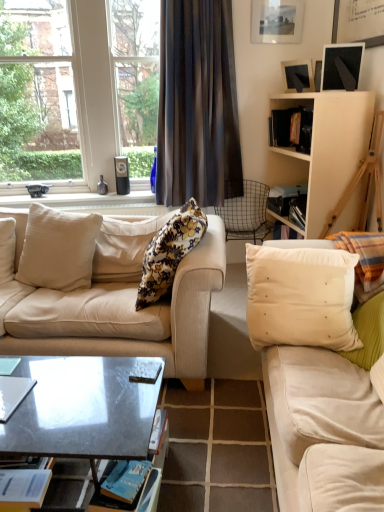
The image size is (384, 512). What do you see at coordinates (197, 105) in the screenshot?
I see `dark fabric curtain at center` at bounding box center [197, 105].

Measure the distance between point (15, 389) and camera.

They are 4.93 feet apart.

Locate an element on the screen. The image size is (384, 512). white cotton pillow at right, which is the third pillow from left to right is located at coordinates coord(301,297).

Image resolution: width=384 pixels, height=512 pixels. In order to click on clear glass window at upper left in this screenshot , I will do `click(75, 92)`.

Measure the distance between clear glass window at upper left and camera.

clear glass window at upper left is 3.03 meters from camera.

What is the approximate height of beige fabric couch at left, which is the first studio couch in left-to-right order?

beige fabric couch at left, which is the first studio couch in left-to-right order, is 80.57 centimeters tall.

Identify the location of floral fabric pillow at center, acting as the third pillow starting from the right. The width and height of the screenshot is (384, 512). (169, 252).

Is beige fabric couch at left, the 2th studio couch when ordered from right to left, inside white matte cabinet at upper right?

No, beige fabric couch at left, the 2th studio couch when ordered from right to left, is not surrounded by white matte cabinet at upper right.

Which is closer, (361,93) or (129,247)?

Positioned in front is point (129,247).

Which is in front, white matte cabinet at upper right or beige fabric couch at left, which is the first studio couch in left-to-right order?

Positioned in front is beige fabric couch at left, which is the first studio couch in left-to-right order.

Which object is thinner, white matte cabinet at upper right or beige fabric couch at left, the 2th studio couch when ordered from right to left?

white matte cabinet at upper right.

Locate an element on the screen. coffee table in front of the beige fabric pillow at left, which ranks as the fourth pillow in right-to-left order is located at coordinates (83, 410).

Is beige fabric pillow at left, which is counted as the 1th pillow, starting from the left, next to metallic gray coffee table at center?

No, beige fabric pillow at left, which is counted as the 1th pillow, starting from the left, is not making contact with metallic gray coffee table at center.

Could metallic gray coffee table at center be considered to be inside beige fabric pillow at left, which is counted as the 1th pillow, starting from the left?

No, metallic gray coffee table at center is not surrounded by beige fabric pillow at left, which is counted as the 1th pillow, starting from the left.

Is beige fabric pillow at left, which ranks as the fourth pillow in right-to-left order, wider or thinner than metallic gray coffee table at center?

beige fabric pillow at left, which ranks as the fourth pillow in right-to-left order, is thinner than metallic gray coffee table at center.

Locate an element on the screen. This screenshot has height=512, width=384. coffee table on the left of matte black picture frame at upper right is located at coordinates (83, 410).

Do you think metallic gray coffee table at center is within matte black picture frame at upper right, or outside of it?

metallic gray coffee table at center exists outside the volume of matte black picture frame at upper right.

From a real-world perspective, which is physically below, metallic gray coffee table at center or matte black picture frame at upper right?

From a 3D spatial view, metallic gray coffee table at center is below.

Which object is further away from the camera, matte black picture frame at upper right or metallic gray coffee table at center?

matte black picture frame at upper right is behind.

From the image's perspective, is matte black picture frame at upper right beneath metallic gray coffee table at center?

Actually, matte black picture frame at upper right appears above metallic gray coffee table at center in the image.

How different are the orientations of matte black picture frame at upper right and metallic gray coffee table at center in degrees?

The facing directions of matte black picture frame at upper right and metallic gray coffee table at center are 52.5 degrees apart.

Would you say clear glass window at upper left is inside or outside matte gray magazine at lower left, which is the 2th magazine in bottom-to-top order?

clear glass window at upper left lies outside matte gray magazine at lower left, which is the 2th magazine in bottom-to-top order.

Is point (12, 177) farther from viewer compared to point (17, 394)?

Yes, point (12, 177) is behind point (17, 394).

Locate an element on the screen. The height and width of the screenshot is (512, 384). the 1st magazine counting from the right of the clear glass window at upper left is located at coordinates (13, 394).

Would you say white fabric pillow at right, which is the 1th pillow from right to left, is to the left or to the right of dark fabric curtain at center in the picture?

Based on their positions, white fabric pillow at right, which is the 1th pillow from right to left, is located to the right of dark fabric curtain at center.

Which pillow is the 2nd one when counting from the right side of the dark fabric curtain at center? Please provide its 2D coordinates.

[(364, 260)]

Is the depth of white fabric pillow at right, marked as the fourth pillow in a left-to-right arrangement, greater than that of dark fabric curtain at center?

No, the depth of white fabric pillow at right, marked as the fourth pillow in a left-to-right arrangement, is less than that of dark fabric curtain at center.

From the image's perspective, is dark fabric curtain at center positioned above or below matte glass window sill at upper left?

dark fabric curtain at center is above matte glass window sill at upper left.

Is dark fabric curtain at center placed right next to matte glass window sill at upper left?

No, dark fabric curtain at center is not touching matte glass window sill at upper left.

Is dark fabric curtain at center aimed at matte glass window sill at upper left?

No.

You are a GUI agent. You are given a task and a screenshot of the screen. Output one action in this format:
    pyautogui.click(x=<x>, y=<y>)
    Task: Click on the cabinetry that is above the beige fabric couch at left, which is the first studio couch in left-to-right order (from a real-world perspective)
    This screenshot has width=384, height=512.
    Given the screenshot: What is the action you would take?
    point(325,149)

Locate an element on the screen. Image resolution: width=384 pixels, height=512 pixels. coffee table lying in front of the beige fabric pillow at left, which is counted as the 1th pillow, starting from the left is located at coordinates (83, 410).

Considering their positions, is matte glass window sill at upper left positioned closer to dark fabric curtain at center than matte gray magazine at lower left, which is counted as the 1th magazine, starting from the top?

matte glass window sill at upper left lies closer to dark fabric curtain at center than the other object.

Estimate the real-world distances between objects in this image. Which object is further from metallic gray coffee table at center, matte gray magazine at lower left, which is counted as the 1th magazine, starting from the top, or white cotton pillow at right, which is the third pillow from left to right?

The object further to metallic gray coffee table at center is white cotton pillow at right, which is the third pillow from left to right.

Based on their spatial positions, is beige fabric pillow at left, which is counted as the 1th pillow, starting from the left, or dark fabric curtain at center further from matte black picture frame at upper right?

beige fabric pillow at left, which is counted as the 1th pillow, starting from the left, is further to matte black picture frame at upper right.

Estimate the real-world distances between objects in this image. Which object is closer to white matte cabinet at upper right, beige fabric couch at left, the 2th studio couch when ordered from right to left, or beige fabric pillow at left, which ranks as the fourth pillow in right-to-left order?

Among the two, beige fabric couch at left, the 2th studio couch when ordered from right to left, is located nearer to white matte cabinet at upper right.

From the image, which object appears to be farther from floral fabric pillow at center, which ranks as the 2th pillow in left-to-right order, metallic gray coffee table at center or matte glass window sill at upper left?

matte glass window sill at upper left.

Estimate the real-world distances between objects in this image. Which object is closer to blue paper magazine at lower left, placed as the second magazine when sorted from top to bottom, dark fabric curtain at center or metallic gray coffee table at center?

The object closer to blue paper magazine at lower left, placed as the second magazine when sorted from top to bottom, is metallic gray coffee table at center.

Considering their positions, is floral fabric armchair at center positioned closer to metallic gray coffee table at center than matte glass window sill at upper left?

matte glass window sill at upper left is positioned closer to the anchor metallic gray coffee table at center.

Based on their spatial positions, is floral fabric pillow at center, acting as the third pillow starting from the right, or matte gray magazine at lower left, which is the 2th magazine in bottom-to-top order, closer to beige fabric couch at left, which is the first studio couch in left-to-right order?

floral fabric pillow at center, acting as the third pillow starting from the right.

The height and width of the screenshot is (512, 384). In order to click on window that lies between matte black picture frame at upper right and matte gray magazine at lower left, which is the 2th magazine in bottom-to-top order, from top to bottom in this screenshot , I will do `click(75, 92)`.

Where is `window sill between clear glass window at upper left and dark fabric curtain at center in the horizontal direction`? window sill between clear glass window at upper left and dark fabric curtain at center in the horizontal direction is located at coordinates (81, 200).

The image size is (384, 512). Find the location of `magazine between beige fabric couch at left, which is the first studio couch in left-to-right order, and metallic gray coffee table at center from top to bottom`. magazine between beige fabric couch at left, which is the first studio couch in left-to-right order, and metallic gray coffee table at center from top to bottom is located at coordinates (13, 394).

Where is `window located between matte gray magazine at lower left, which is the 2th magazine in bottom-to-top order, and floral fabric armchair at center in the depth direction`? This screenshot has width=384, height=512. window located between matte gray magazine at lower left, which is the 2th magazine in bottom-to-top order, and floral fabric armchair at center in the depth direction is located at coordinates (75, 92).